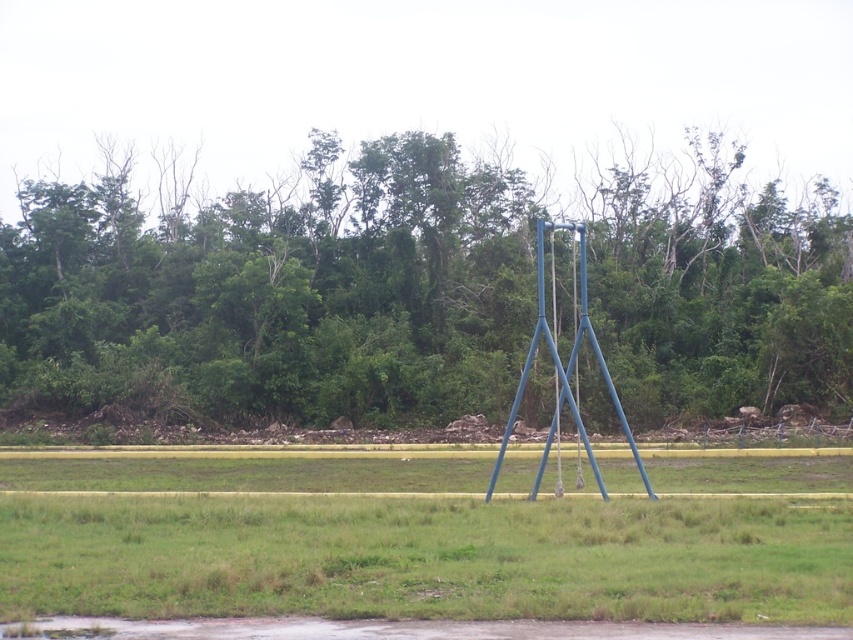
Is green leafy trees at center smaller than blue metallic swing set at center?

Actually, green leafy trees at center might be larger than blue metallic swing set at center.

Which is above, green leafy trees at center or blue metallic swing set at center?

green leafy trees at center

Locate an element on the screen. green leafy trees at center is located at coordinates (276, 291).